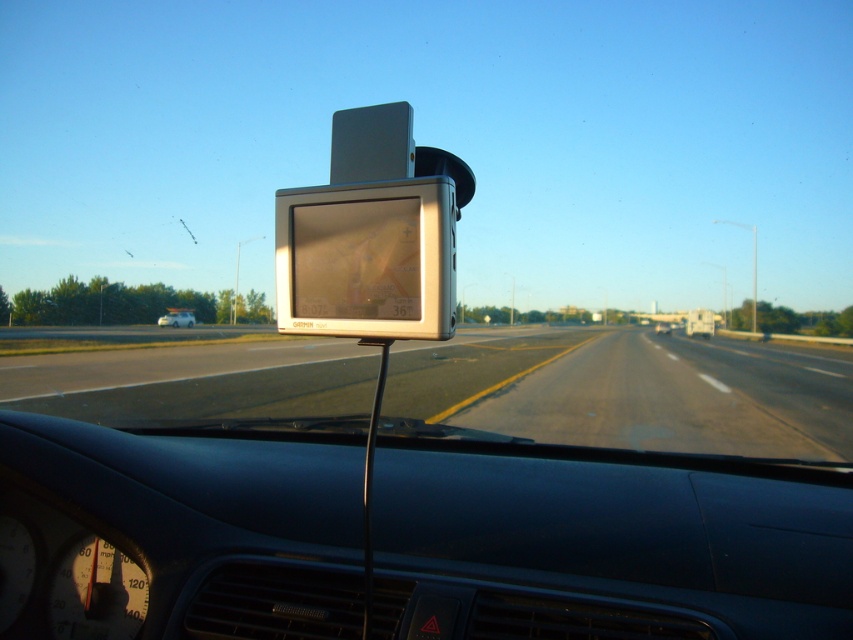
What is the 2D coordinate of the smooth asphalt highway at center?

The smooth asphalt highway at center is located at the 2D coordinate point of (633, 392).

You are driving a car and notice the smooth asphalt highway at center and the white matte van at lower left in your view. Which object is nearer to you according to their positions in the scene?

The smooth asphalt highway at center is closer to the viewer than the white matte van at lower left, so the smooth asphalt highway at center is nearer to you.

You are the driver of the car and want to know which of the two points, point (x=485, y=416) or point (x=160, y=324), is closer to you. According to the GPS device mounted on the windshield, which point is nearer?

Point (x=485, y=416) is closer to the viewer than point (x=160, y=324).